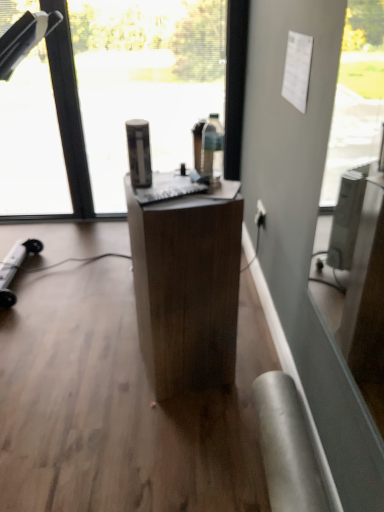
The width and height of the screenshot is (384, 512). What are the coordinates of `vacant area situated below transparent glass window at center (from a real-world perspective)` in the screenshot? It's located at (84, 282).